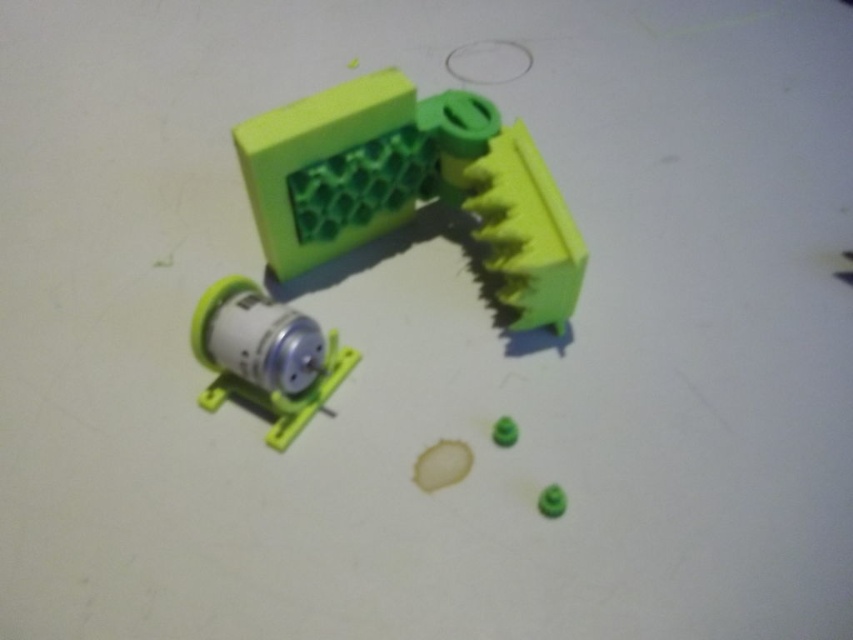
Question: Considering the relative positions of green matte plastic brush at upper center and green matte ball at lower right in the image provided, where is green matte plastic brush at upper center located with respect to green matte ball at lower right?

Choices:
 (A) left
 (B) right

Answer: (A)

Question: Among these objects, which one is nearest to the camera?

Choices:
 (A) green matte plastic brush at upper center
 (B) green matte ball at lower right
 (C) green matte plastic toy at center
 (D) metallic silver motor at lower left

Answer: (D)

Question: Which is nearer to the metallic silver motor at lower left?

Choices:
 (A) green matte plastic brush at upper center
 (B) green matte ball at lower right
 (C) green matte plastic toy at center

Answer: (A)

Question: Is metallic silver motor at lower left positioned before green matte ball at lower right?

Choices:
 (A) no
 (B) yes

Answer: (B)

Question: Which object is closer to the camera taking this photo?

Choices:
 (A) green matte ball at lower right
 (B) green matte plastic toy at center
 (C) green matte plastic brush at upper center
 (D) metallic silver motor at lower left

Answer: (D)

Question: Can you confirm if green matte plastic brush at upper center is positioned below green matte plastic toy at center?

Choices:
 (A) yes
 (B) no

Answer: (B)